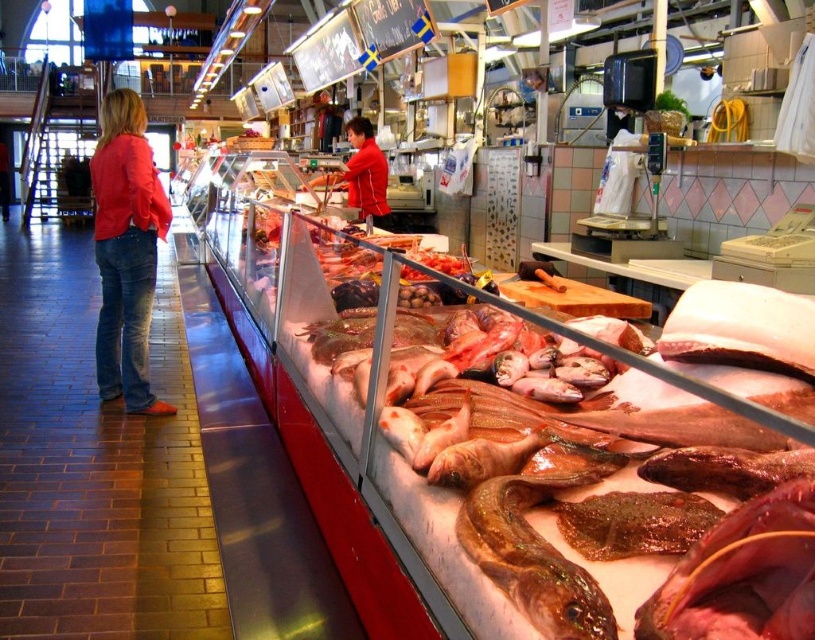
Question: Which is farther from the matte red shirt at center?

Choices:
 (A) shiny brown fish at center
 (B) shiny red fish at center

Answer: (B)

Question: Is shiny red fish at center wider than matte red shirt at center?

Choices:
 (A) no
 (B) yes

Answer: (A)

Question: Can you confirm if shiny red fish at center is positioned to the left of denim jeans at left?

Choices:
 (A) no
 (B) yes

Answer: (A)

Question: Which object is positioned closest to the matte red shirt at center?

Choices:
 (A) denim jeans at left
 (B) shiny red fish at center
 (C) shiny brown fish at center

Answer: (A)

Question: Estimate the real-world distances between objects in this image. Which object is closer to the denim jeans at left?

Choices:
 (A) matte red shirt at center
 (B) shiny red fish at center

Answer: (A)

Question: Does shiny red fish at center come in front of denim jeans at left?

Choices:
 (A) yes
 (B) no

Answer: (A)